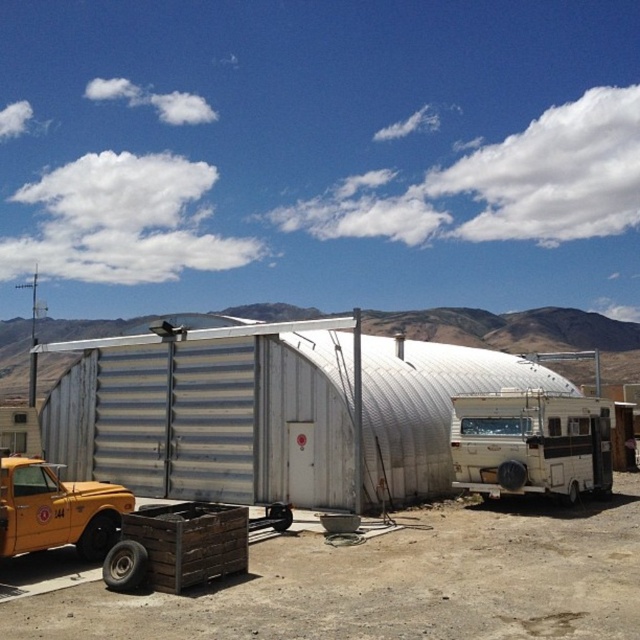
Between point (202, 342) and point (588, 426), which one is positioned in front?

Point (588, 426)

Locate an element on the screen. silver corrugated metal shed at center is located at coordinates (269, 410).

The height and width of the screenshot is (640, 640). I want to click on silver corrugated metal shed at center, so click(x=269, y=410).

This screenshot has height=640, width=640. In order to click on silver corrugated metal shed at center in this screenshot , I will do `click(269, 410)`.

Who is positioned more to the right, white matte trailer truck at right or yellow matte truck at lower left?

white matte trailer truck at right

Is white matte trailer truck at right taller than yellow matte truck at lower left?

Incorrect, white matte trailer truck at right's height is not larger of yellow matte truck at lower left's.

Describe the element at coordinates (531, 444) in the screenshot. This screenshot has width=640, height=640. I see `white matte trailer truck at right` at that location.

At what (x,y) coordinates should I click in order to perform the action: click on white matte trailer truck at right. Please return your answer as a coordinate pair (x, y). Looking at the image, I should click on (531, 444).

Who is higher up, silver corrugated metal shed at center or yellow matte truck at lower left?

silver corrugated metal shed at center is above.

Who is taller, silver corrugated metal shed at center or yellow matte truck at lower left?

silver corrugated metal shed at center is taller.

Locate an element on the screen. silver corrugated metal shed at center is located at coordinates (269, 410).

You are a GUI agent. You are given a task and a screenshot of the screen. Output one action in this format:
    pyautogui.click(x=<x>, y=<y>)
    Task: Click on the silver corrugated metal shed at center
    This screenshot has width=640, height=640.
    Given the screenshot: What is the action you would take?
    pyautogui.click(x=269, y=410)